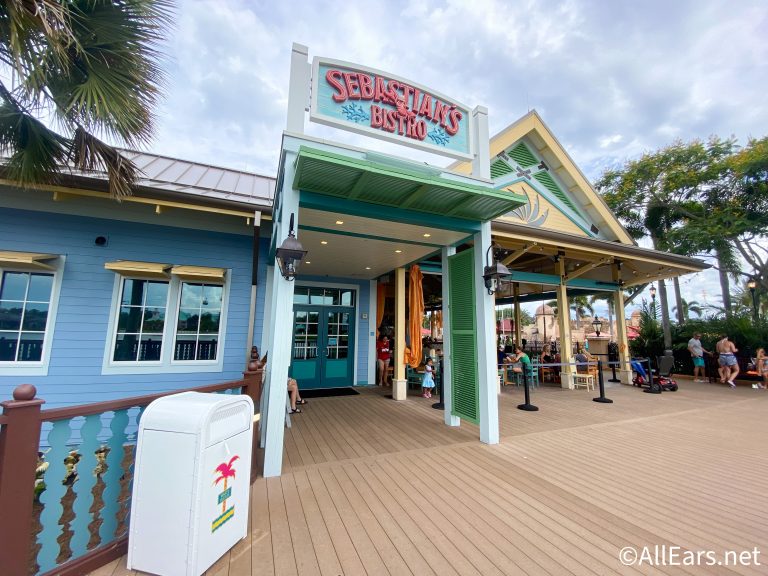
Image resolution: width=768 pixels, height=576 pixels. In order to click on lamp in this screenshot , I will do `click(654, 291)`, `click(763, 282)`.